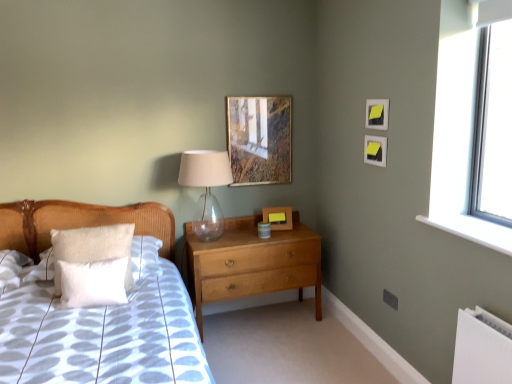
Measure the distance between point [377,154] and camera.

Point [377,154] is 8.81 feet from camera.

In order to face wooden picture frame at center, which is the third picture frame from right to left, should I rotate leftwards or rightwards?

Turn right by 2.993 degrees to look at wooden picture frame at center, which is the third picture frame from right to left.

This screenshot has width=512, height=384. Find the location of `white fluffy pillow at left, which is counted as the second pillow, starting from the front`. white fluffy pillow at left, which is counted as the second pillow, starting from the front is located at coordinates (93, 248).

Where is `transparent glass table lamp at upper center`? transparent glass table lamp at upper center is located at coordinates (206, 188).

From the image's perspective, which is above, white fluffy pillow at left, marked as the second pillow in a back-to-front arrangement, or matte yellow picture frame at upper right, marked as the 1th picture frame in a front-to-back arrangement?

matte yellow picture frame at upper right, marked as the 1th picture frame in a front-to-back arrangement.

Looking at this image, from a real-world perspective, which is physically below, white fluffy pillow at left, marked as the second pillow in a back-to-front arrangement, or matte yellow picture frame at upper right, positioned as the fourth picture frame in back-to-front order?

white fluffy pillow at left, marked as the second pillow in a back-to-front arrangement, from a real-world perspective.

Is white fluffy pillow at left, marked as the second pillow in a back-to-front arrangement, smaller than matte yellow picture frame at upper right, positioned as the fourth picture frame in back-to-front order?

Incorrect, white fluffy pillow at left, marked as the second pillow in a back-to-front arrangement, is not smaller in size than matte yellow picture frame at upper right, positioned as the fourth picture frame in back-to-front order.

Is point (117, 295) farther from camera compared to point (379, 105)?

No, it is in front of (379, 105).

From the image's perspective, relative to white fluffy pillow at left, the first pillow when ordered from front to back, is light brown wood chest of drawers at center above or below?

light brown wood chest of drawers at center is situated lower than white fluffy pillow at left, the first pillow when ordered from front to back, in the image.

How much distance is there between light brown wood chest of drawers at center and white fluffy pillow at left, marked as the second pillow in a back-to-front arrangement?

light brown wood chest of drawers at center and white fluffy pillow at left, marked as the second pillow in a back-to-front arrangement, are 36.20 inches apart.

Is light brown wood chest of drawers at center positioned with its back to white fluffy pillow at left, marked as the second pillow in a back-to-front arrangement?

No, light brown wood chest of drawers at center is not facing away from white fluffy pillow at left, marked as the second pillow in a back-to-front arrangement.

Based on their positions, is light brown wood chest of drawers at center located to the left or right of white fluffy pillow at left, the first pillow when ordered from front to back?

Clearly, light brown wood chest of drawers at center is on the right of white fluffy pillow at left, the first pillow when ordered from front to back, in the image.

Looking at this image, choose the correct answer: Is matte yellow picture frame at upper right, marked as the 1th picture frame in a front-to-back arrangement, inside wooden picture frame at upper center, positioned as the 2th picture frame in back-to-front order, or outside it?

The correct answer is: outside.

Are matte yellow picture frame at upper right, positioned as the fourth picture frame in back-to-front order, and wooden picture frame at upper center, marked as the 3th picture frame in a front-to-back arrangement, located far from each other?

That's not correct — matte yellow picture frame at upper right, positioned as the fourth picture frame in back-to-front order, is a little close to wooden picture frame at upper center, marked as the 3th picture frame in a front-to-back arrangement.

Could you measure the distance between matte yellow picture frame at upper right, positioned as the fourth picture frame in back-to-front order, and wooden picture frame at upper center, which is the fourth picture frame from right to left?

The distance of matte yellow picture frame at upper right, positioned as the fourth picture frame in back-to-front order, from wooden picture frame at upper center, which is the fourth picture frame from right to left, is 37.44 inches.

Between matte yellow picture frame at upper right, which is counted as the third picture frame, starting from the left, and wooden picture frame at upper center, which is the fourth picture frame from right to left, which one has smaller size?

matte yellow picture frame at upper right, which is counted as the third picture frame, starting from the left, is smaller.

From the image's perspective, is yellow paper picture frame at upper right, the 3th picture frame positioned from the back, above white fabric bed at center?

Indeed, from the image's perspective, yellow paper picture frame at upper right, the 3th picture frame positioned from the back, is shown above white fabric bed at center.

From the picture: From a real-world perspective, is yellow paper picture frame at upper right, acting as the first picture frame starting from the right, located beneath white fabric bed at center?

No, from a real-world perspective, yellow paper picture frame at upper right, acting as the first picture frame starting from the right, is not below white fabric bed at center.

Could you measure the distance between yellow paper picture frame at upper right, the 3th picture frame positioned from the back, and white fabric bed at center?

A distance of 5.91 feet exists between yellow paper picture frame at upper right, the 3th picture frame positioned from the back, and white fabric bed at center.

Can we say yellow paper picture frame at upper right, marked as the 4th picture frame in a left-to-right arrangement, lies outside white fabric bed at center?

Yes, yellow paper picture frame at upper right, marked as the 4th picture frame in a left-to-right arrangement, is outside of white fabric bed at center.

Is white fluffy pillow at left, which ranks as the first pillow in back-to-front order, at the back of yellow paper picture frame at upper right, the 3th picture frame positioned from the back?

No, yellow paper picture frame at upper right, the 3th picture frame positioned from the back, is not facing away from white fluffy pillow at left, which ranks as the first pillow in back-to-front order.

Is yellow paper picture frame at upper right, marked as the 4th picture frame in a left-to-right arrangement, positioned beyond the bounds of white fluffy pillow at left, which is counted as the second pillow, starting from the front?

Yes, yellow paper picture frame at upper right, marked as the 4th picture frame in a left-to-right arrangement, is located beyond the bounds of white fluffy pillow at left, which is counted as the second pillow, starting from the front.

Is there a large distance between yellow paper picture frame at upper right, arranged as the 2th picture frame when viewed from the front, and white fluffy pillow at left, which ranks as the first pillow in back-to-front order?

Yes, yellow paper picture frame at upper right, arranged as the 2th picture frame when viewed from the front, is far from white fluffy pillow at left, which ranks as the first pillow in back-to-front order.

How different are the orientations of yellow paper picture frame at upper right, arranged as the 2th picture frame when viewed from the front, and white fluffy pillow at left, which ranks as the first pillow in back-to-front order, in degrees?

86.9 degrees separate the facing orientations of yellow paper picture frame at upper right, arranged as the 2th picture frame when viewed from the front, and white fluffy pillow at left, which ranks as the first pillow in back-to-front order.

Would you say wooden picture frame at upper center, marked as the 3th picture frame in a front-to-back arrangement, is part of white fabric bed at center's contents?

→ Actually, wooden picture frame at upper center, marked as the 3th picture frame in a front-to-back arrangement, is outside white fabric bed at center.

Can you confirm if white fabric bed at center is positioned to the right of wooden picture frame at upper center, which is the 1th picture frame from left to right?

Incorrect, white fabric bed at center is not on the right side of wooden picture frame at upper center, which is the 1th picture frame from left to right.

Does white fabric bed at center have a greater width compared to wooden picture frame at upper center, which is the fourth picture frame from right to left?

Yes.

Is point (288, 228) positioned before point (295, 223)?

Yes, point (288, 228) is closer to viewer.

Is wooden picture frame at center, which is the third picture frame from right to left, spatially inside light brown wood chest of drawers at center, or outside of it?

wooden picture frame at center, which is the third picture frame from right to left, is not inside light brown wood chest of drawers at center, it's outside.

Considering the sizes of wooden picture frame at center, which ranks as the 4th picture frame in front-to-back order, and light brown wood chest of drawers at center in the image, is wooden picture frame at center, which ranks as the 4th picture frame in front-to-back order, taller or shorter than light brown wood chest of drawers at center?

Clearly, wooden picture frame at center, which ranks as the 4th picture frame in front-to-back order, is shorter compared to light brown wood chest of drawers at center.

Which picture frame is the 2nd one when counting from the right side of the light brown wood chest of drawers at center? Please provide its 2D coordinates.

[(278, 217)]

At what (x,y) coordinates should I click in order to perform the action: click on the 1st pillow to the left of the matte yellow picture frame at upper right, positioned as the fourth picture frame in back-to-front order, starting your count from the anchor. Please return your answer as a coordinate pair (x, y). The height and width of the screenshot is (384, 512). Looking at the image, I should click on (93, 283).

The width and height of the screenshot is (512, 384). Find the location of `the 1st pillow above the light brown wood chest of drawers at center (from the image's perspective)`. the 1st pillow above the light brown wood chest of drawers at center (from the image's perspective) is located at coordinates (93, 283).

When comparing their distances from wooden picture frame at upper center, positioned as the 2th picture frame in back-to-front order, does transparent glass table lamp at upper center or white fluffy pillow at left, which ranks as the first pillow in back-to-front order, seem closer?

The object closer to wooden picture frame at upper center, positioned as the 2th picture frame in back-to-front order, is transparent glass table lamp at upper center.

Based on their spatial positions, is wooden picture frame at upper center, which is the 1th picture frame from left to right, or white fluffy pillow at left, the first pillow when ordered from front to back, closer to wooden picture frame at center, which ranks as the 4th picture frame in front-to-back order?

wooden picture frame at upper center, which is the 1th picture frame from left to right, is closer to wooden picture frame at center, which ranks as the 4th picture frame in front-to-back order.

Based on their spatial positions, is white fluffy pillow at left, marked as the second pillow in a back-to-front arrangement, or light brown wood chest of drawers at center closer to transparent plastic window screen at upper right?

light brown wood chest of drawers at center is positioned closer to the anchor transparent plastic window screen at upper right.

When comparing their distances from white fluffy pillow at left, marked as the second pillow in a back-to-front arrangement, does white fluffy pillow at left, which ranks as the first pillow in back-to-front order, or transparent glass table lamp at upper center seem closer?

white fluffy pillow at left, which ranks as the first pillow in back-to-front order, is positioned closer to the anchor white fluffy pillow at left, marked as the second pillow in a back-to-front arrangement.

From the image, which object appears to be farther from yellow paper picture frame at upper right, the 3th picture frame positioned from the back, transparent glass table lamp at upper center or transparent plastic window screen at upper right?

transparent glass table lamp at upper center.

From the image, which object appears to be farther from transparent plastic window screen at upper right, white fluffy pillow at left, the first pillow when ordered from front to back, or yellow paper picture frame at upper right, acting as the first picture frame starting from the right?

white fluffy pillow at left, the first pillow when ordered from front to back.

Based on their spatial positions, is matte yellow picture frame at upper right, which is counted as the third picture frame, starting from the left, or light brown wood chest of drawers at center closer to wooden picture frame at center, which is the third picture frame from right to left?

Among the two, light brown wood chest of drawers at center is located nearer to wooden picture frame at center, which is the third picture frame from right to left.

Looking at the image, which one is located further to matte yellow picture frame at upper right, marked as the 1th picture frame in a front-to-back arrangement, wooden picture frame at center, which is the third picture frame from right to left, or wooden picture frame at upper center, which is the 1th picture frame from left to right?

The object further to matte yellow picture frame at upper right, marked as the 1th picture frame in a front-to-back arrangement, is wooden picture frame at center, which is the third picture frame from right to left.

You are a GUI agent. You are given a task and a screenshot of the screen. Output one action in this format:
    pyautogui.click(x=<x>, y=<y>)
    Task: Click on the chest of drawers located between white fluffy pillow at left, which is counted as the second pillow, starting from the front, and matte yellow picture frame at upper right, positioned as the fourth picture frame in back-to-front order, in the left-right direction
    
    Given the screenshot: What is the action you would take?
    pyautogui.click(x=252, y=263)

This screenshot has width=512, height=384. Find the location of `chest of drawers between white fluffy pillow at left, the first pillow when ordered from front to back, and yellow paper picture frame at upper right, arranged as the 2th picture frame when viewed from the front`. chest of drawers between white fluffy pillow at left, the first pillow when ordered from front to back, and yellow paper picture frame at upper right, arranged as the 2th picture frame when viewed from the front is located at coordinates (252, 263).

Where is `window screen between white fabric bed at center and wooden picture frame at center, the first picture frame viewed from the back, along the z-axis`? window screen between white fabric bed at center and wooden picture frame at center, the first picture frame viewed from the back, along the z-axis is located at coordinates (493, 127).

Where is `table lamp between white fabric bed at center and transparent plastic window screen at upper right`? This screenshot has width=512, height=384. table lamp between white fabric bed at center and transparent plastic window screen at upper right is located at coordinates (206, 188).